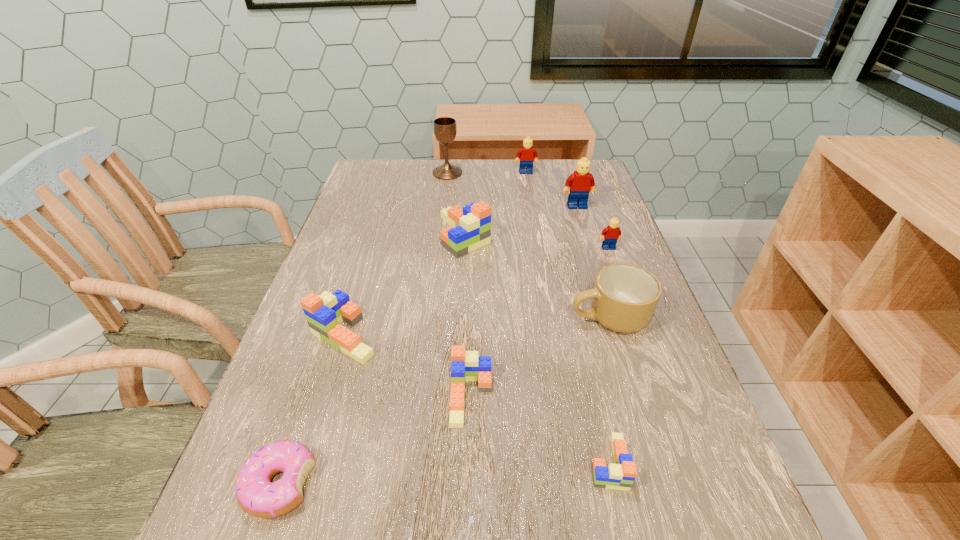
Locate an element on the screen. Lego that is the fifth closest to the farthest yellow Lego is located at coordinates (465, 365).

Point out which yellow Lego is positioned as the third nearest to the nearest orange Lego. Please provide its 2D coordinates. Your answer should be formatted as a tuple, i.e. [(x, y)], where the tuple contains the x and y coordinates of a point satisfying the conditions above.

[(527, 154)]

The height and width of the screenshot is (540, 960). I want to click on the closest yellow Lego to the biggest orange Lego, so click(x=581, y=182).

Where is `orange Lego that can be found as the second closest to the mug`? orange Lego that can be found as the second closest to the mug is located at coordinates (620, 476).

Locate an element on the screen. The height and width of the screenshot is (540, 960). orange Lego that is the closest to the rightmost orange Lego is located at coordinates (465, 365).

Locate an element on the screen. The image size is (960, 540). vacant space that satisfies the following two spatial constraints: 1. on the front side of the sixth farthest Lego; 2. on the right side of the nearest Lego is located at coordinates (470, 462).

At what (x,y) coordinates should I click in order to perform the action: click on free location that satisfies the following two spatial constraints: 1. on the side with the handle of the mug; 2. on the front-facing side of the second smallest yellow Lego. Please return your answer as a coordinate pair (x, y). Looking at the image, I should click on (564, 172).

At what (x,y) coordinates should I click in order to perform the action: click on free location that satisfies the following two spatial constraints: 1. on the front side of the chalice; 2. on the left side of the nearest Lego. Please return your answer as a coordinate pair (x, y). The width and height of the screenshot is (960, 540). Looking at the image, I should click on (414, 462).